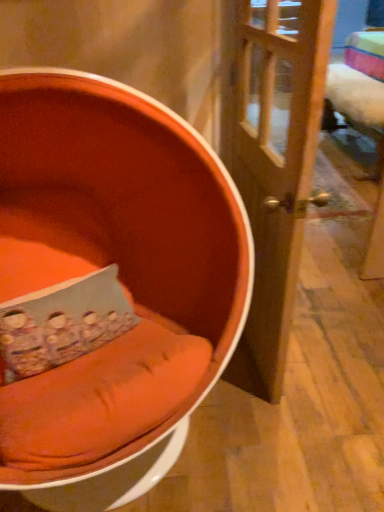
Question: Can you confirm if floral fabric pillow at center is smaller than orange fabric chair at left?

Choices:
 (A) no
 (B) yes

Answer: (B)

Question: Can you confirm if floral fabric pillow at center is wider than orange fabric chair at left?

Choices:
 (A) no
 (B) yes

Answer: (A)

Question: From the image's perspective, does floral fabric pillow at center appear higher than orange fabric chair at left?

Choices:
 (A) yes
 (B) no

Answer: (B)

Question: From the image's perspective, does floral fabric pillow at center appear lower than orange fabric chair at left?

Choices:
 (A) yes
 (B) no

Answer: (A)

Question: From a real-world perspective, is floral fabric pillow at center below orange fabric chair at left?

Choices:
 (A) yes
 (B) no

Answer: (A)

Question: Is floral fabric pillow at center positioned in front of orange fabric chair at left?

Choices:
 (A) no
 (B) yes

Answer: (A)

Question: Is orange fabric chair at left not near wooden door at center?

Choices:
 (A) no
 (B) yes

Answer: (A)

Question: Does orange fabric chair at left lie in front of wooden door at center?

Choices:
 (A) no
 (B) yes

Answer: (B)

Question: Does orange fabric chair at left lie behind wooden door at center?

Choices:
 (A) no
 (B) yes

Answer: (A)

Question: Does orange fabric chair at left have a lesser height compared to wooden door at center?

Choices:
 (A) no
 (B) yes

Answer: (B)

Question: Is orange fabric chair at left oriented away from wooden door at center?

Choices:
 (A) no
 (B) yes

Answer: (A)

Question: From the image's perspective, is orange fabric chair at left on wooden door at center?

Choices:
 (A) yes
 (B) no

Answer: (B)

Question: Is floral fabric pillow at center positioned behind wooden door at center?

Choices:
 (A) no
 (B) yes

Answer: (B)